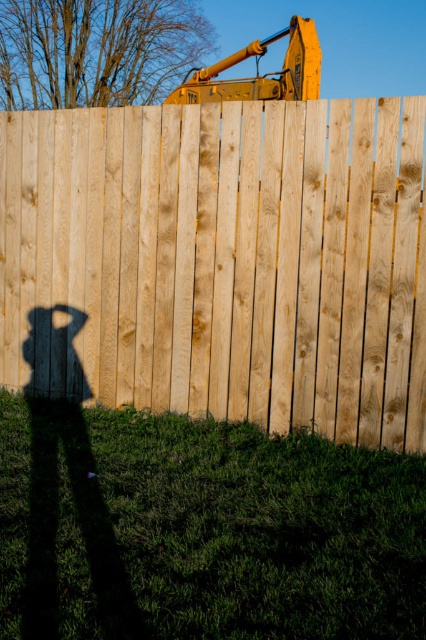
You are a photographer trying to capture both the natural wood fence at center and the yellow metallic excavator at upper center in the same frame. Based on their sizes in the image, which object would appear closer to the camera?

The natural wood fence at center appears closer to the camera because it is smaller than the yellow metallic excavator at upper center, which typically indicates that smaller objects are nearer in such perspective.

You are standing in front of the natural wood fence at center and want to see the yellow metallic excavator at upper center. Which direction should you look to see the excavator?

The yellow metallic excavator at upper center is above the natural wood fence at center, so you should look upward to see it.

You are standing in front of the natural wood fence at center and want to see the yellow metallic excavator at upper center behind it. Can you see the entire excavator through the fence?

The natural wood fence at center is closer to the viewer than the yellow metallic excavator at upper center, so the fence may block part of the excavator from view.